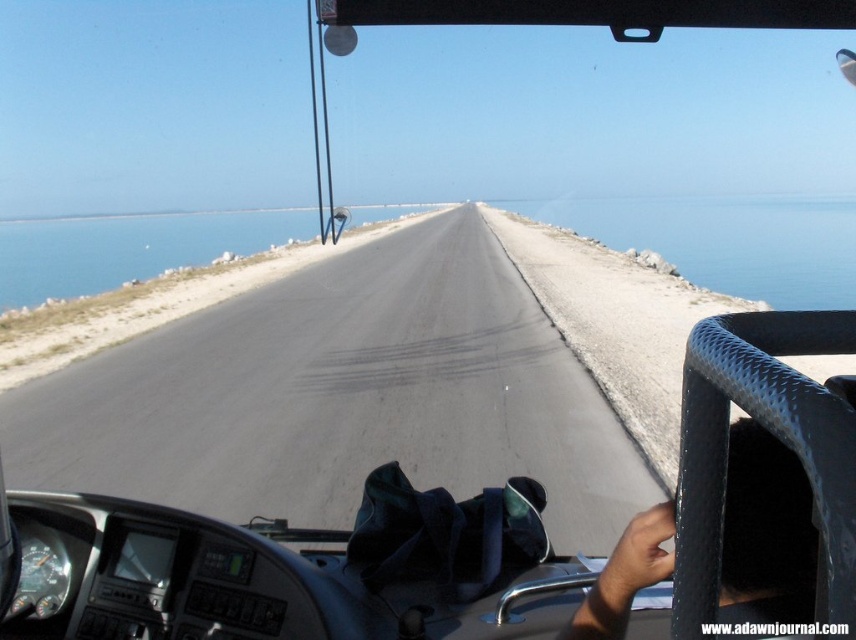
Does asphalt road at center have a larger size compared to dark skin textured hand at lower right?

Yes, asphalt road at center is bigger than dark skin textured hand at lower right.

Can you confirm if asphalt road at center is taller than dark skin textured hand at lower right?

Correct, asphalt road at center is much taller as dark skin textured hand at lower right.

Between point (473, 353) and point (580, 604), which one is positioned behind?

The point (473, 353) is more distant.

Locate an element on the screen. The image size is (856, 640). asphalt road at center is located at coordinates (342, 396).